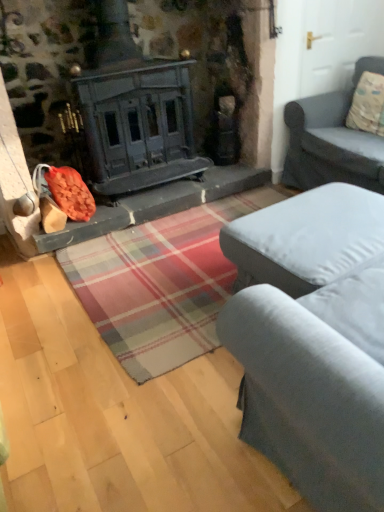
Question: Does gray fabric ottoman at center, positioned as the second studio couch in back-to-front order, have a lesser width compared to gray fabric couch at right, placed as the 2th studio couch when sorted from front to back?

Choices:
 (A) no
 (B) yes

Answer: (B)

Question: Considering the relative sizes of gray fabric ottoman at center, which is counted as the 1th studio couch, starting from the front, and gray fabric couch at right, acting as the 2th studio couch starting from the bottom, in the image provided, is gray fabric ottoman at center, which is counted as the 1th studio couch, starting from the front, wider than gray fabric couch at right, acting as the 2th studio couch starting from the bottom,?

Choices:
 (A) no
 (B) yes

Answer: (A)

Question: From the image's perspective, is gray fabric ottoman at center, marked as the 1th studio couch in a bottom-to-top arrangement, located beneath gray fabric couch at right, placed as the 2th studio couch when sorted from front to back?

Choices:
 (A) no
 (B) yes

Answer: (B)

Question: Can you see gray fabric ottoman at center, the 2th studio couch positioned from the top, touching gray fabric couch at right, which is the 1th studio couch in back-to-front order?

Choices:
 (A) no
 (B) yes

Answer: (A)

Question: Is gray fabric ottoman at center, marked as the 1th studio couch in a bottom-to-top arrangement, bigger than gray fabric couch at right, which is the 1th studio couch in back-to-front order?

Choices:
 (A) no
 (B) yes

Answer: (A)

Question: Is gray fabric ottoman at center, which is counted as the 1th studio couch, starting from the front, taller than gray fabric couch at right, the 1th studio couch viewed from the top?

Choices:
 (A) yes
 (B) no

Answer: (B)

Question: From a real-world perspective, is gray fabric ottoman at center, the 2th studio couch positioned from the top, positioned under fluffy beige pillow at upper right based on gravity?

Choices:
 (A) no
 (B) yes

Answer: (B)

Question: Is the position of gray fabric ottoman at center, which is counted as the 1th studio couch, starting from the front, less distant than that of fluffy beige pillow at upper right?

Choices:
 (A) no
 (B) yes

Answer: (B)

Question: Is gray fabric ottoman at center, which is counted as the 1th studio couch, starting from the front, thinner than fluffy beige pillow at upper right?

Choices:
 (A) yes
 (B) no

Answer: (B)

Question: Is gray fabric ottoman at center, the 2th studio couch positioned from the top, behind fluffy beige pillow at upper right?

Choices:
 (A) yes
 (B) no

Answer: (B)

Question: Would you say gray fabric ottoman at center, which is counted as the 1th studio couch, starting from the front, is outside fluffy beige pillow at upper right?

Choices:
 (A) yes
 (B) no

Answer: (A)

Question: Can you confirm if gray fabric ottoman at center, marked as the 1th studio couch in a bottom-to-top arrangement, is wider than fluffy beige pillow at upper right?

Choices:
 (A) yes
 (B) no

Answer: (A)

Question: Can you confirm if gray fabric couch at right, which is the 1th studio couch in back-to-front order, is thinner than fluffy beige pillow at upper right?

Choices:
 (A) no
 (B) yes

Answer: (A)